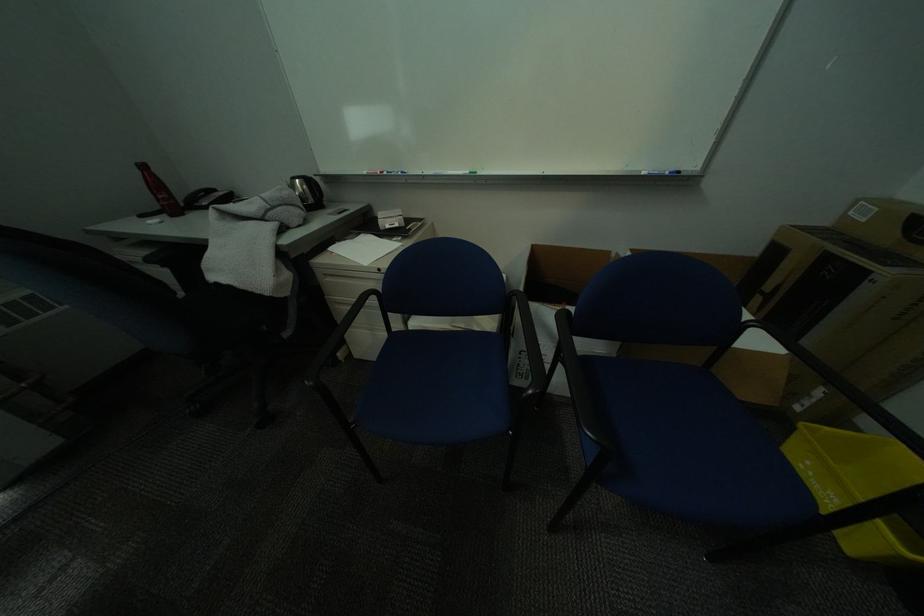
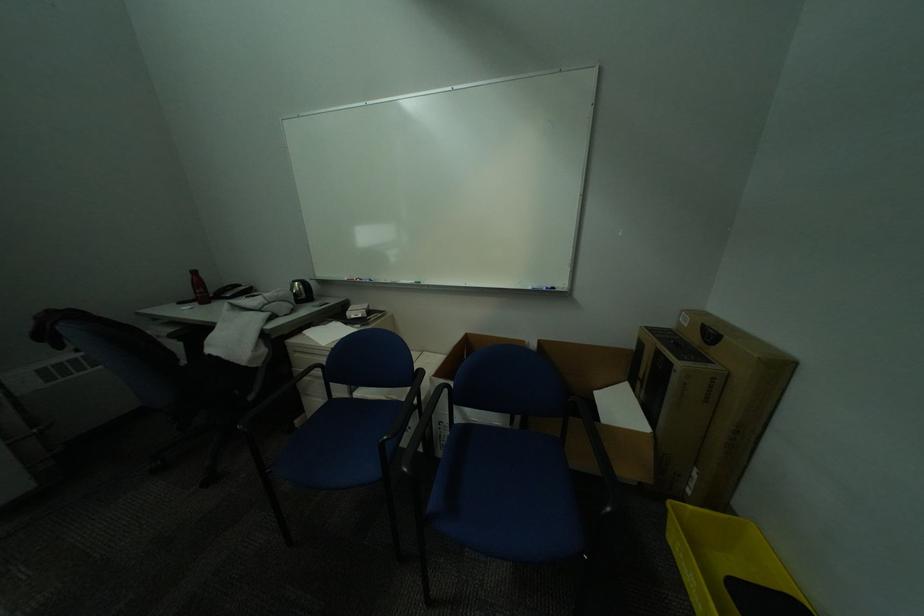
The point at (x=654, y=175) is marked in the first image. Where is the corresponding point in the second image?

(541, 289)